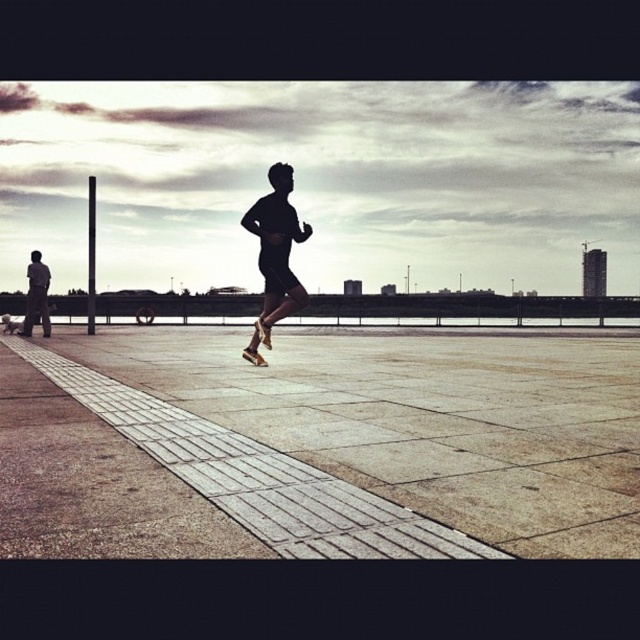
Is gray concrete pavement at center positioned before black matte running shoes at center?

Yes, it is.

Is gray concrete pavement at center to the right of black matte running shoes at center from the viewer's perspective?

Indeed, gray concrete pavement at center is positioned on the right side of black matte running shoes at center.

Between point (204, 525) and point (268, 342), which one is positioned behind?

The point (268, 342) is more distant.

The width and height of the screenshot is (640, 640). Identify the location of gray concrete pavement at center. (324, 444).

Is black matte running shoes at center taller than dark gray pants at left?

Incorrect, black matte running shoes at center's height is not larger of dark gray pants at left's.

Between point (284, 172) and point (33, 317), which one is positioned in front?

Point (284, 172) is in front.

Which is in front, point (275, 224) or point (49, 332)?

Point (275, 224) is in front.

Where is `black matte running shoes at center`? This screenshot has width=640, height=640. black matte running shoes at center is located at coordinates (275, 257).

Who is taller, gray concrete pavement at center or dark gray pants at left?

dark gray pants at left is taller.

Locate an element on the screen. The height and width of the screenshot is (640, 640). gray concrete pavement at center is located at coordinates (324, 444).